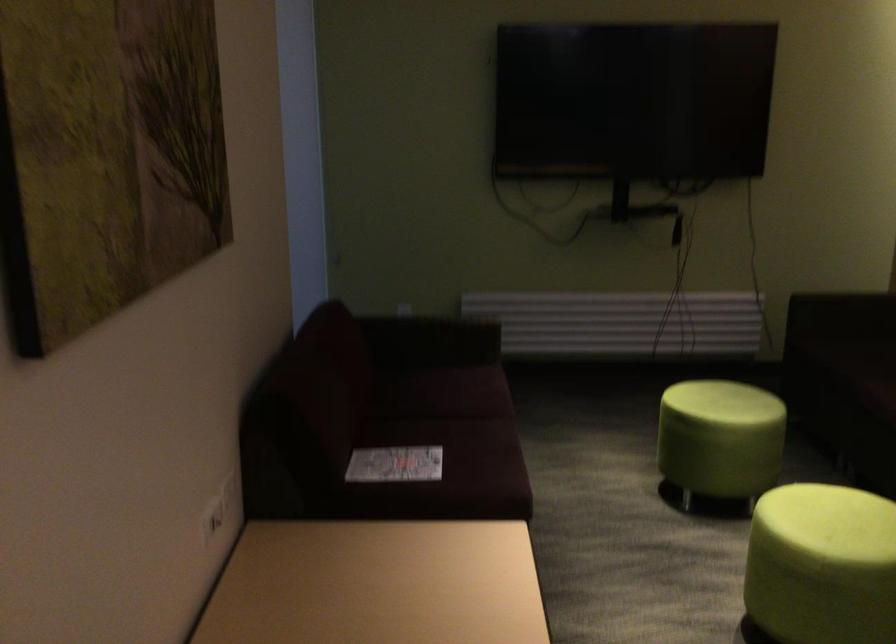
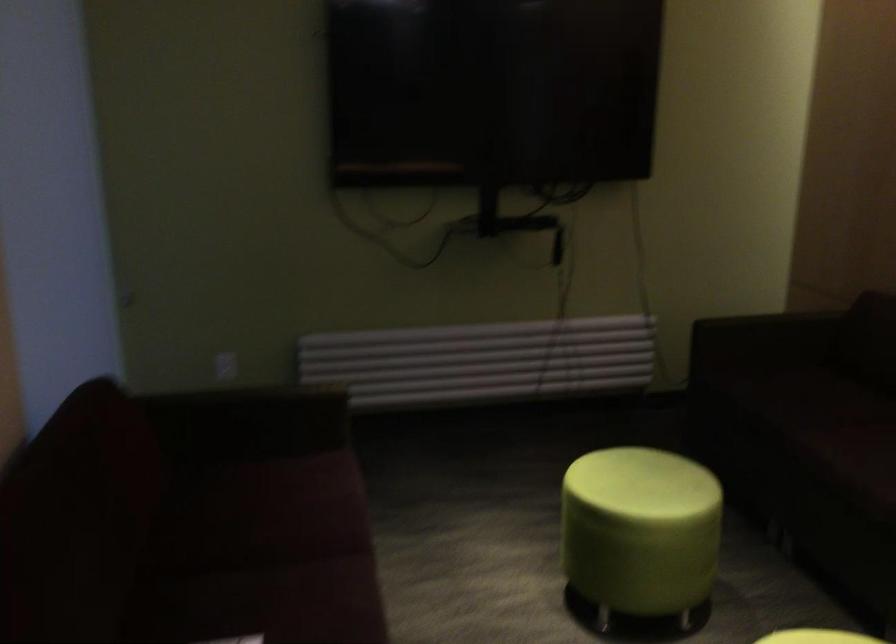
Question: The camera is either moving clockwise (left) or counter-clockwise (right) around the object. The first image is from the beginning of the video and the second image is from the end. Is the camera moving left or right when shooting the video?

Choices:
 (A) Left
 (B) Right

Answer: (A)